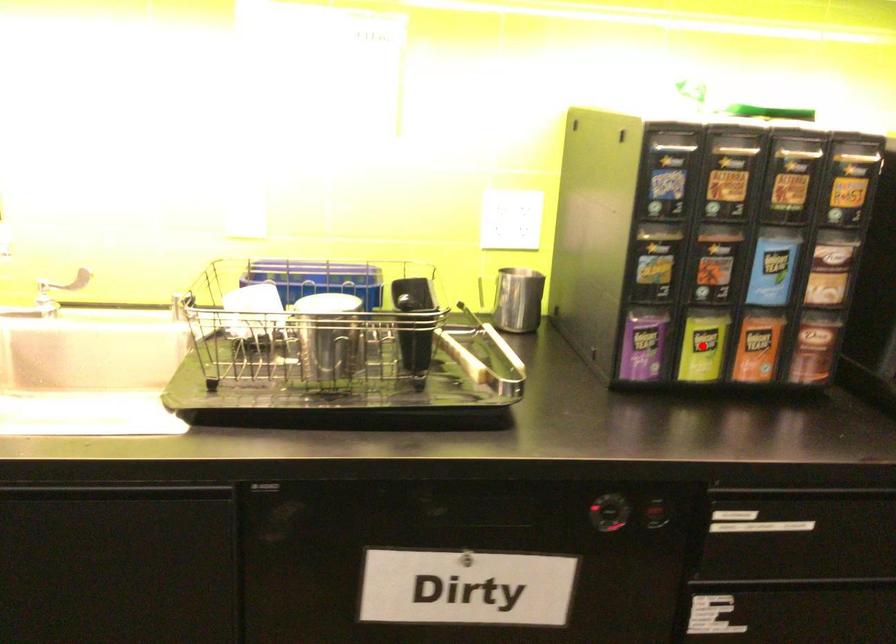
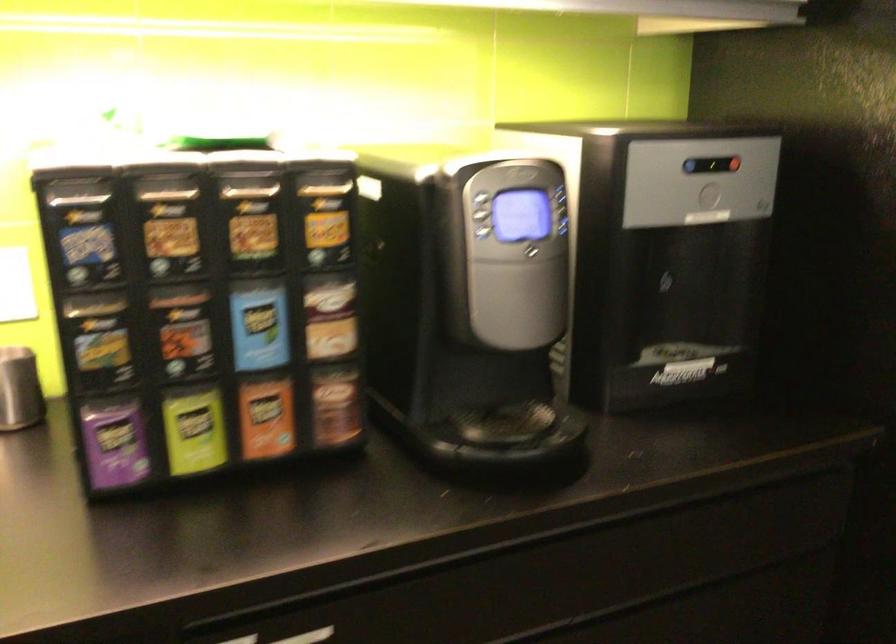
Question: I am providing you with two images of the same scene from different viewpoints. A red point is shown in image1. For the corresponding object point in image2, is it positioned nearer or farther from the camera?

Choices:
 (A) Nearer
 (B) Farther

Answer: (A)